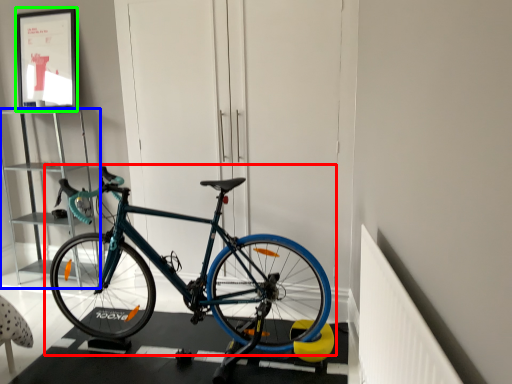
Question: Considering the real-world distances, which object is closest to bicycle (highlighted by a red box)? cabinet (highlighted by a blue box) or picture frame (highlighted by a green box).

Choices:
 (A) cabinet
 (B) picture frame

Answer: (A)